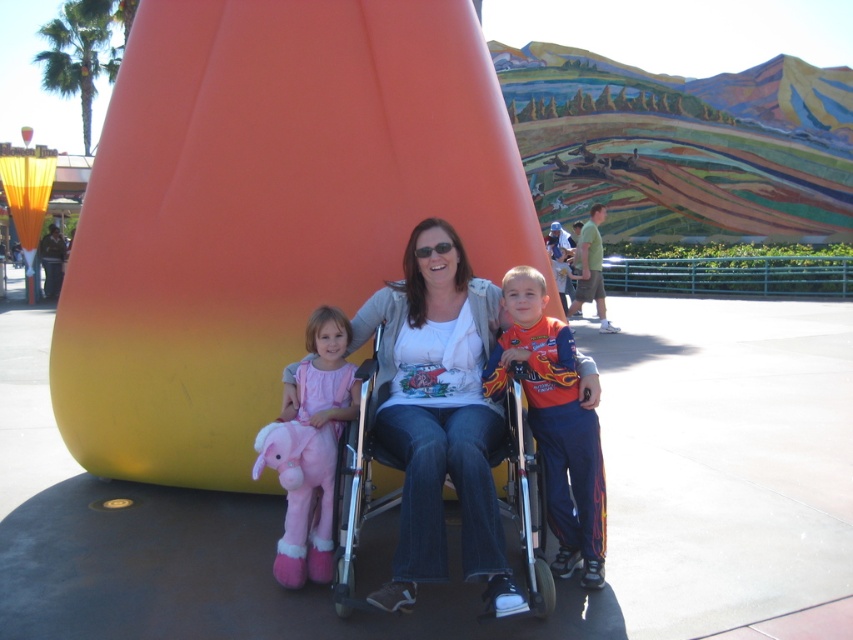
You are a delivery person who needs to place a small package between the metallic silver wheelchair at center and the pink plush toy at left. Can you fit the package there if the package is 1 meter wide?

The metallic silver wheelchair at center is narrower than the pink plush toy at left. Since the package is 1 meter wide, but the space between them depends on their combined widths and positioning. However, since the wheelchair is narrower, the space might be insufficient. Without exact measurements, it is uncertain.

In the scene shown: You are a photographer setting up for a group photo. The metallic silver wheelchair at center and the pink plush toy at left are in your frame. Based on their heights, which object should you adjust your camera angle to focus on first?

The metallic silver wheelchair at center has a lesser height compared to the pink plush toy at left, so you should focus on the metallic silver wheelchair at center first to ensure it is properly in frame before adjusting for the taller toy.